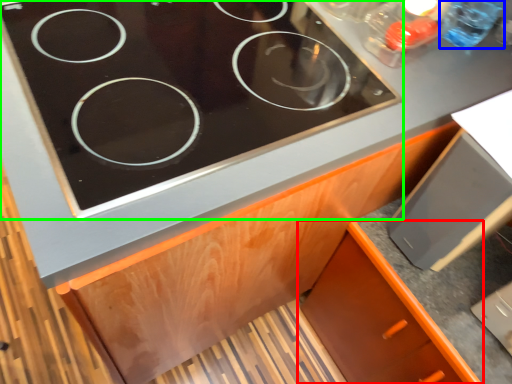
Question: Which object is the closest to the cabinetry (highlighted by a red box)? Choose among these: bottle (highlighted by a blue box) or gas stove (highlighted by a green box).

Choices:
 (A) bottle
 (B) gas stove

Answer: (B)